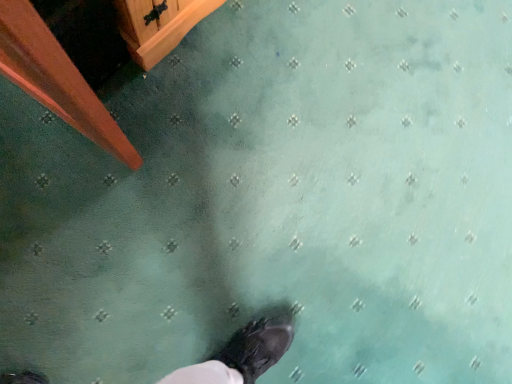
I want to click on wooden cabinet at upper left, so click(x=56, y=79).

What do you see at coordinates (56, 79) in the screenshot? Image resolution: width=512 pixels, height=384 pixels. I see `wooden cabinet at upper left` at bounding box center [56, 79].

Identify the location of wooden cabinet at upper left. (56, 79).